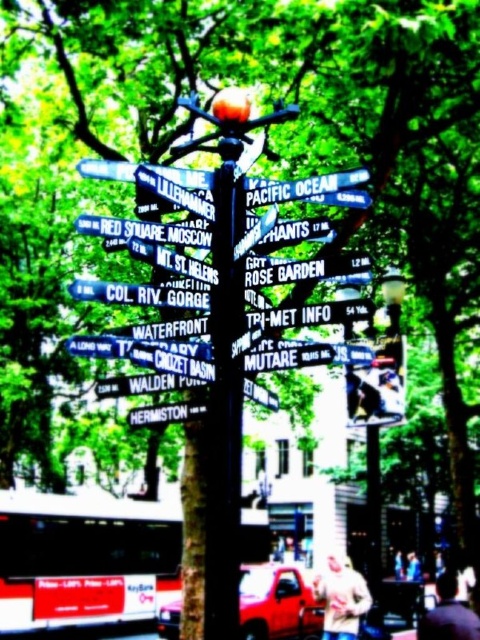
You are a city planner reviewing the layout of the street signpost. Which of the two signs, the black plastic street signs at center or the green matte street sign at center, is shorter?

The black plastic street signs at center has a lesser height compared to the green matte street sign at center, so the black plastic street signs at center is shorter.

You are a pedestrian standing in front of the large street signpost and want to hand a map to someone wearing the light beige sweater at lower center. However, there is a dark brown leather jacket at lower right in your path. Can you reach the person without moving the jacket?

The dark brown leather jacket at lower right is behind the light beige sweater at lower center, so you can reach the person wearing the light beige sweater at lower center without moving the jacket since the jacket is not blocking the path.

You are standing in the park and see the metallic silver signpost at center. If you were to draw a straight line from your current position to the signpost, what coordinates would mark the exact center of the signpost?

The exact center of the metallic silver signpost at center is located at coordinates point (168, 196).